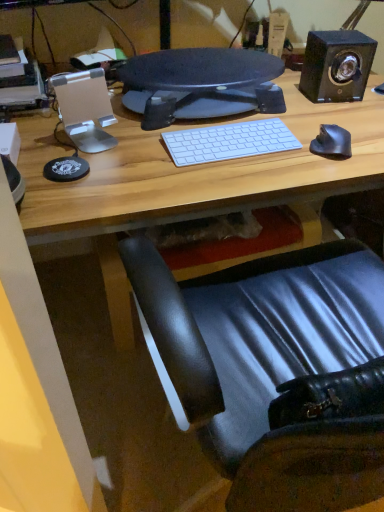
I want to click on free location above matte black monitor at center (from a real-world perspective), so click(200, 69).